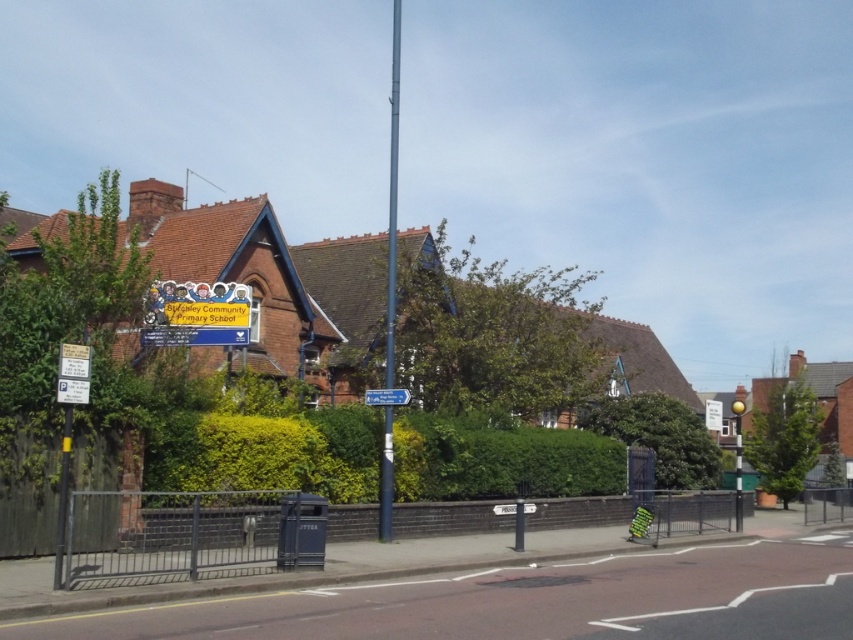
You are a delivery driver who needs to park your vehicle near the Syfcaley Community Primary School. There is a green leafy hedge at center and a white plastic parking sign at center in the image. Which object takes up more space horizontally between them?

The green leafy hedge at center has a larger width than the white plastic parking sign at center, so the green leafy hedge at center takes up more horizontal space.

You are a parent dropping off your child at Syfcaley Community Primary School. You notice the green leafy hedge at center and the white plastic parking sign at center near the entrance. Which object would block your view more if you were standing at the entrance?

The green leafy hedge at center is much taller than the white plastic parking sign at center, so it would block your view more.

You are a parent dropping off your child at Syfcaley Community Primary School. You notice the green leafy hedge at center and the white plastic parking sign at center. Which object is blocking your view of the other?

The green leafy hedge at center is positioned over the white plastic parking sign at center, so the hedge is blocking the view of the parking sign.